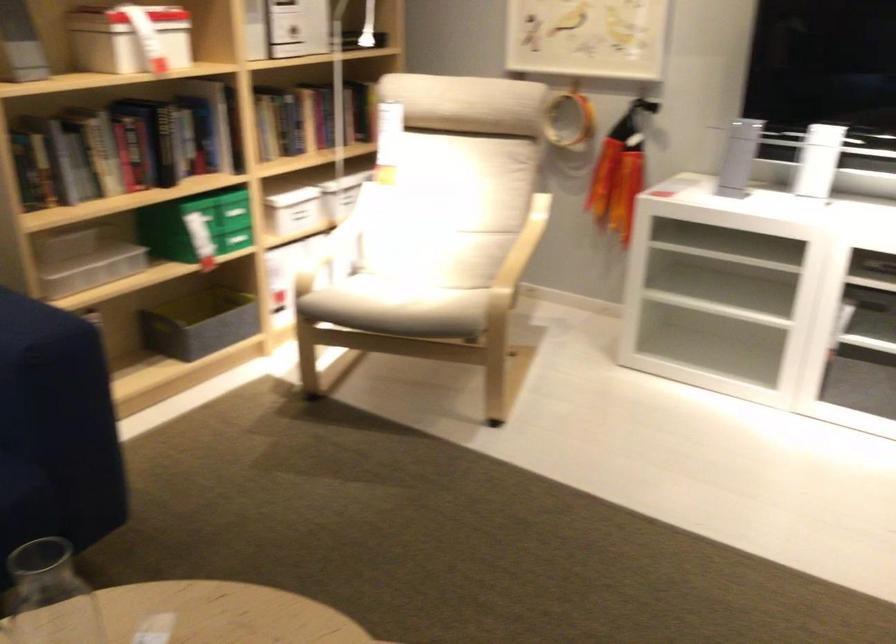
The location [195,225] corresponds to which object?

It corresponds to the green storage box in the image.